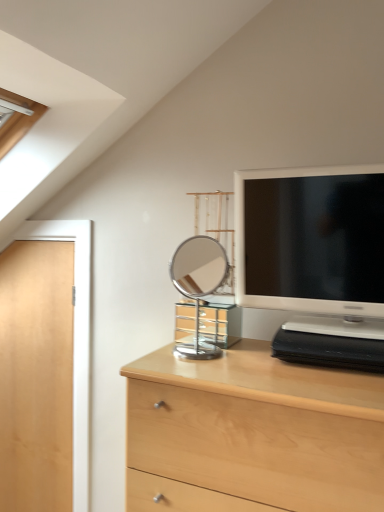
Question: Is light wood chest of drawers at center to the right of light wood door at left from the viewer's perspective?

Choices:
 (A) no
 (B) yes

Answer: (B)

Question: From the image's perspective, is light wood chest of drawers at center over light wood door at left?

Choices:
 (A) yes
 (B) no

Answer: (B)

Question: Are light wood chest of drawers at center and light wood door at left far apart?

Choices:
 (A) no
 (B) yes

Answer: (A)

Question: From a real-world perspective, is light wood chest of drawers at center over light wood door at left?

Choices:
 (A) no
 (B) yes

Answer: (A)

Question: Does light wood chest of drawers at center have a greater height compared to light wood door at left?

Choices:
 (A) no
 (B) yes

Answer: (A)

Question: Considering the positions of point (69, 495) and point (187, 270), is point (69, 495) closer or farther from the camera than point (187, 270)?

Choices:
 (A) farther
 (B) closer

Answer: (B)

Question: Considering their positions, is light wood door at left located in front of or behind polished chrome mirror at center?

Choices:
 (A) front
 (B) behind

Answer: (B)

Question: Based on their positions, is light wood door at left located to the left or right of polished chrome mirror at center?

Choices:
 (A) right
 (B) left

Answer: (B)

Question: Which is correct: light wood door at left is inside polished chrome mirror at center, or outside of it?

Choices:
 (A) inside
 (B) outside

Answer: (B)

Question: Considering the relative positions of matte white television at upper right and light wood chest of drawers at center in the image provided, is matte white television at upper right to the left or to the right of light wood chest of drawers at center?

Choices:
 (A) left
 (B) right

Answer: (B)

Question: Does point (382, 202) appear closer or farther from the camera than point (261, 474)?

Choices:
 (A) closer
 (B) farther

Answer: (B)

Question: From a real-world perspective, is matte white television at upper right physically located above or below light wood chest of drawers at center?

Choices:
 (A) above
 (B) below

Answer: (A)

Question: In the image, is matte white television at upper right positioned in front of or behind light wood chest of drawers at center?

Choices:
 (A) front
 (B) behind

Answer: (B)

Question: Is light wood chest of drawers at center inside the boundaries of light wood door at left, or outside?

Choices:
 (A) inside
 (B) outside

Answer: (B)

Question: Is point (367, 445) closer or farther from the camera than point (59, 407)?

Choices:
 (A) farther
 (B) closer

Answer: (B)